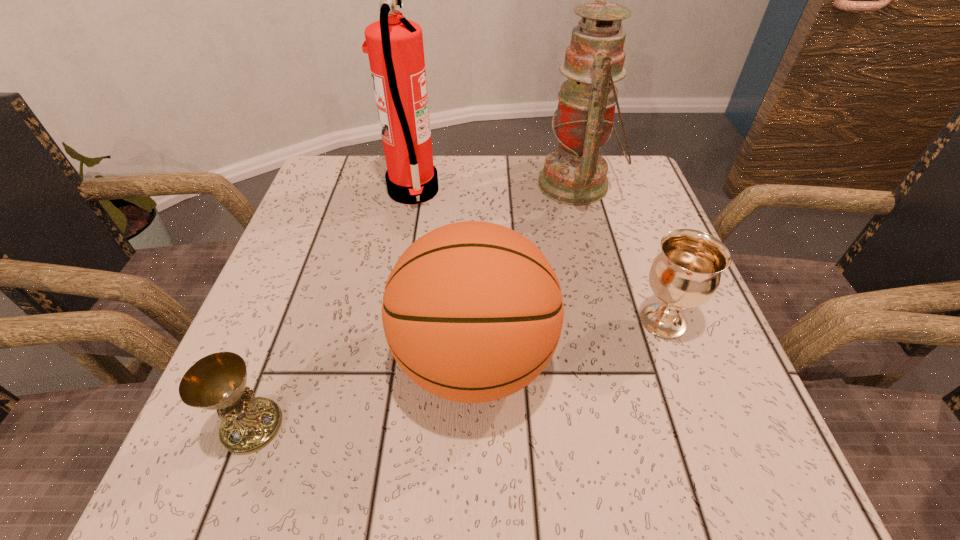
Find the location of a particular element. free space that satisfies the following two spatial constraints: 1. with the nozzle aimed from the right chalice; 2. on the left side of the fire extinguisher is located at coordinates (390, 321).